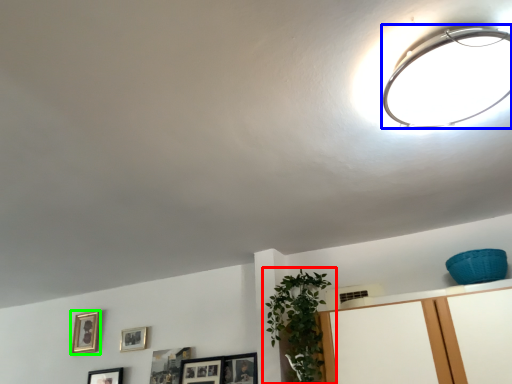
Question: Which is nearer to the houseplant (highlighted by a red box)? lamp (highlighted by a blue box) or picture frame (highlighted by a green box).

Choices:
 (A) lamp
 (B) picture frame

Answer: (A)